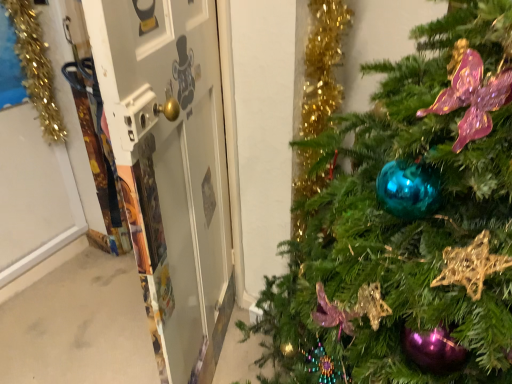
Question: Is shiny teal ornament at center-right smaller than gold tinsel garland at left?

Choices:
 (A) yes
 (B) no

Answer: (B)

Question: Considering the relative sizes of shiny teal ornament at center-right and gold tinsel garland at left in the image provided, is shiny teal ornament at center-right taller than gold tinsel garland at left?

Choices:
 (A) yes
 (B) no

Answer: (A)

Question: Is shiny teal ornament at center-right at the left side of gold tinsel garland at left?

Choices:
 (A) no
 (B) yes

Answer: (A)

Question: Is shiny teal ornament at center-right facing away from gold tinsel garland at left?

Choices:
 (A) yes
 (B) no

Answer: (B)

Question: Is shiny teal ornament at center-right oriented towards gold tinsel garland at left?

Choices:
 (A) yes
 (B) no

Answer: (B)

Question: Is shiny teal ornament at center-right positioned in front of gold tinsel garland at left?

Choices:
 (A) no
 (B) yes

Answer: (B)

Question: Can you confirm if gold tinsel garland at left is shorter than metallic gold screen door at left?

Choices:
 (A) no
 (B) yes

Answer: (B)

Question: Is gold tinsel garland at left completely or partially outside of metallic gold screen door at left?

Choices:
 (A) yes
 (B) no

Answer: (A)

Question: Does gold tinsel garland at left have a smaller size compared to metallic gold screen door at left?

Choices:
 (A) no
 (B) yes

Answer: (B)

Question: Is gold tinsel garland at left positioned in front of metallic gold screen door at left?

Choices:
 (A) no
 (B) yes

Answer: (A)

Question: Does gold tinsel garland at left appear on the right side of metallic gold screen door at left?

Choices:
 (A) no
 (B) yes

Answer: (A)

Question: Is gold tinsel garland at left positioned with its back to metallic gold screen door at left?

Choices:
 (A) yes
 (B) no

Answer: (B)

Question: Is metallic gold screen door at left far away from shiny teal ornament at center-right?

Choices:
 (A) no
 (B) yes

Answer: (A)